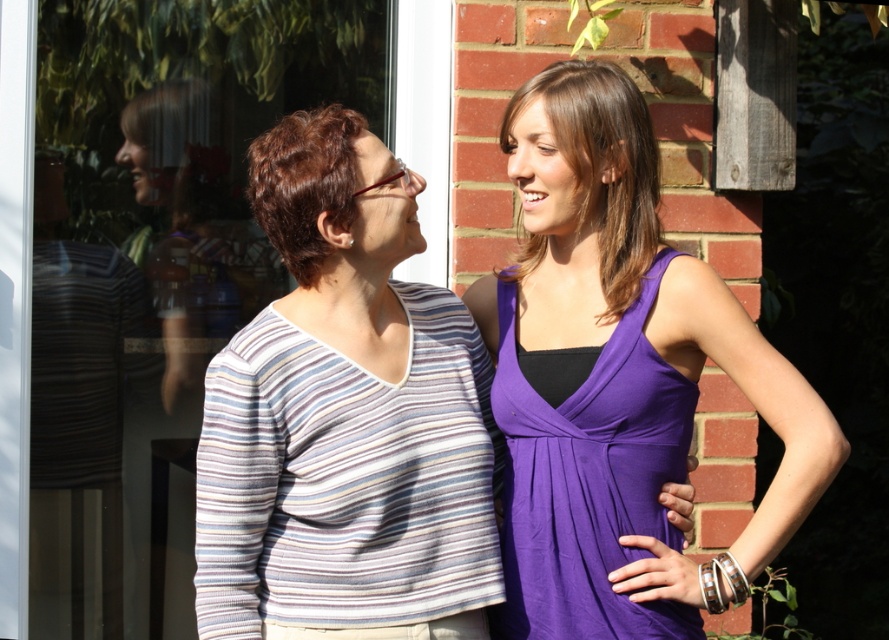
Does purple fabric dress at right appear on the left side of dark brown hair at center?

Incorrect, purple fabric dress at right is not on the left side of dark brown hair at center.

Is purple fabric dress at right bigger than dark brown hair at center?

Correct, purple fabric dress at right is larger in size than dark brown hair at center.

Between point (615, 477) and point (282, 196), which one is positioned in front?

Positioned in front is point (282, 196).

Identify the location of purple fabric dress at right. (618, 380).

Can you confirm if purple fabric dress at right is positioned below purple satin dress at right?

No, purple fabric dress at right is not below purple satin dress at right.

Is the position of purple fabric dress at right more distant than that of purple satin dress at right?

No, it is in front of purple satin dress at right.

At what (x,y) coordinates should I click in order to perform the action: click on purple fabric dress at right. Please return your answer as a coordinate pair (x, y). Looking at the image, I should click on (618, 380).

Is striped fabric shirt at center taller than purple satin dress at upper right?

Correct, striped fabric shirt at center is much taller as purple satin dress at upper right.

Which is behind, point (303, 285) or point (593, 100)?

The point (303, 285) is more distant.

Find the location of a particular element. striped fabric shirt at center is located at coordinates (345, 413).